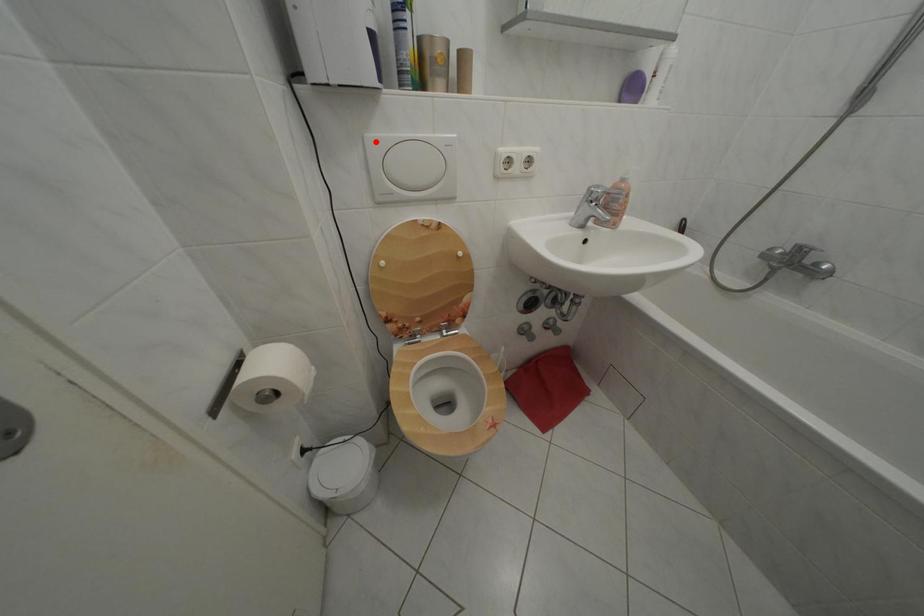
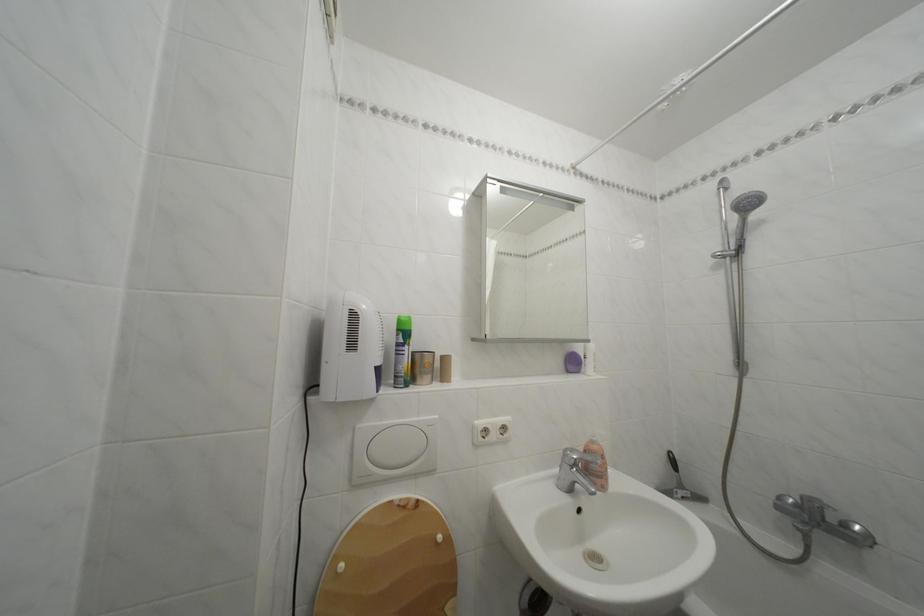
Where in the second image is the point corresponding to the highlighted location from the first image?

(368, 432)